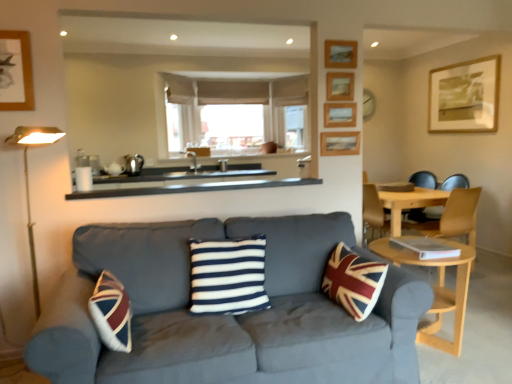
The width and height of the screenshot is (512, 384). I want to click on free space above light wood round table at lower right (from a real-world perspective), so click(x=412, y=250).